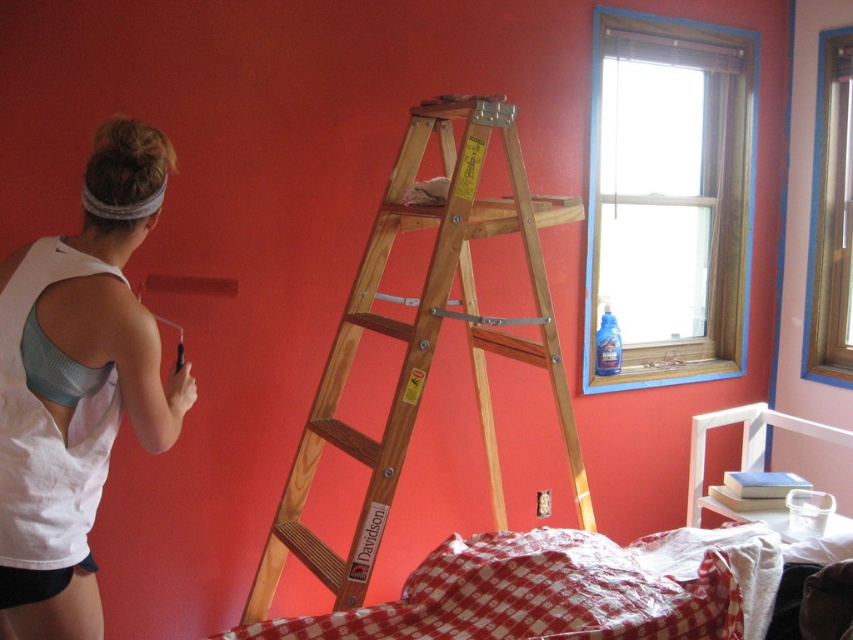
Question: Is wooden ladder at center further to the viewer compared to white fabric tank top at upper left?

Choices:
 (A) no
 (B) yes

Answer: (B)

Question: Does wooden ladder at center have a smaller size compared to red checkered fabric at center?

Choices:
 (A) yes
 (B) no

Answer: (B)

Question: Among these objects, which one is farthest from the camera?

Choices:
 (A) white fabric tank top at upper left
 (B) wooden ladder at center

Answer: (B)

Question: In this image, where is red checkered fabric at center located relative to white fabric tank top at upper left?

Choices:
 (A) left
 (B) right

Answer: (B)

Question: Considering the real-world distances, which object is closest to the white fabric tank top at upper left?

Choices:
 (A) wooden ladder at center
 (B) red checkered fabric at center

Answer: (A)

Question: Which point is closer to the camera?

Choices:
 (A) (631, 588)
 (B) (102, 198)
 (C) (303, 545)

Answer: (B)